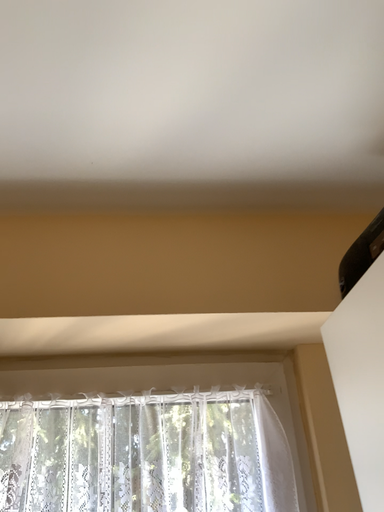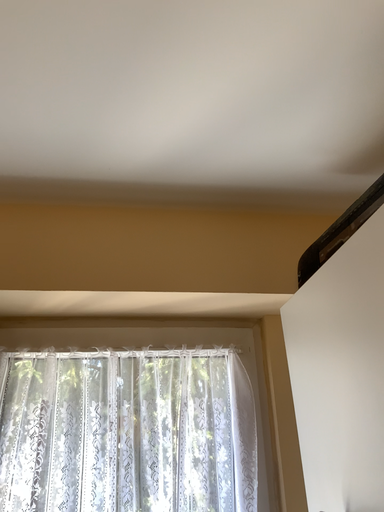
Question: Which way did the camera rotate in the video?

Choices:
 (A) rotated downward
 (B) rotated upward

Answer: (A)